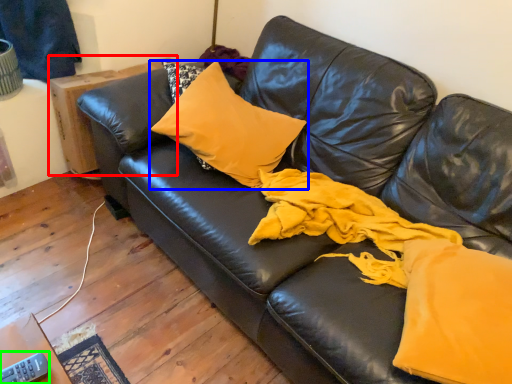
Question: Considering the real-world distances, which object is closest to table (highlighted by a red box)? pillow (highlighted by a blue box) or remote (highlighted by a green box).

Choices:
 (A) pillow
 (B) remote

Answer: (A)